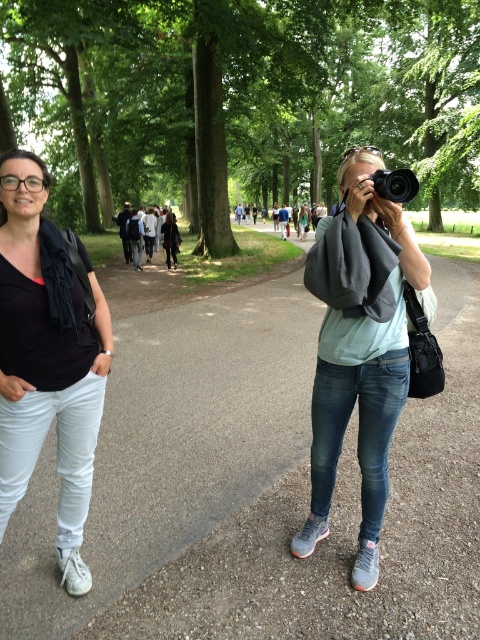
Based on the photo, can you confirm if smooth asphalt path at center is smaller than matte gray camera at center?

Incorrect, smooth asphalt path at center is not smaller in size than matte gray camera at center.

Who is more forward, (x=218, y=296) or (x=339, y=188)?

Positioned in front is point (x=339, y=188).

In order to click on smooth asphalt path at center in this screenshot , I will do `click(170, 445)`.

Is point (349, 413) farther from camera compared to point (63, 385)?

Yes, point (349, 413) is farther from viewer.

Consider the image. Is matte gray camera at center bigger than matte black shirt at left?

Yes, matte gray camera at center is bigger than matte black shirt at left.

Does point (379, 282) come closer to viewer compared to point (26, 180)?

No, (379, 282) is further to viewer.

This screenshot has height=640, width=480. Find the location of `matte gray camera at center`. matte gray camera at center is located at coordinates (362, 348).

Is matte gray camera at center bigger than black plastic camera at center?

Yes.

Identify the location of matte gray camera at center. This screenshot has width=480, height=640. (362, 348).

This screenshot has height=640, width=480. Describe the element at coordinates (362, 348) in the screenshot. I see `matte gray camera at center` at that location.

At what (x,y) coordinates should I click in order to perform the action: click on matte gray camera at center. Please return your answer as a coordinate pair (x, y). The image size is (480, 640). Looking at the image, I should click on (362, 348).